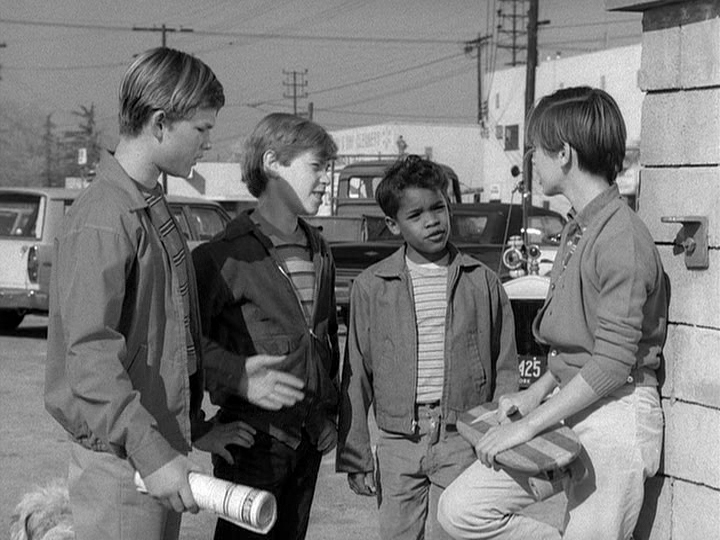
Locate an element on the screen. The height and width of the screenshot is (540, 720). rolled paper is located at coordinates pos(228,498).